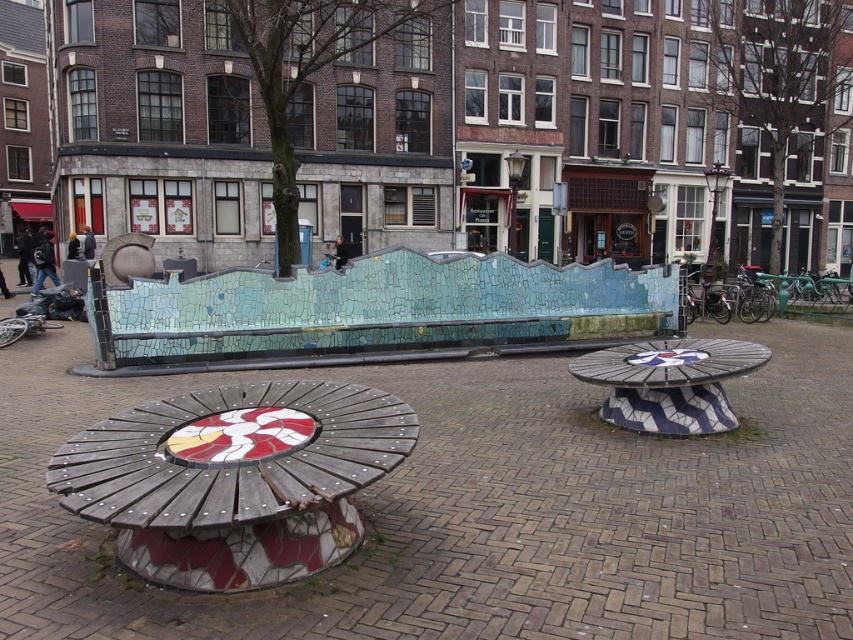
Question: Can you confirm if wooden mosaic bench at lower left is wider than white glossy mosaic table at center?

Choices:
 (A) no
 (B) yes

Answer: (B)

Question: Is wooden mosaic bench at lower left bigger than white glossy mosaic table at center?

Choices:
 (A) yes
 (B) no

Answer: (B)

Question: Which object is closer to the camera taking this photo?

Choices:
 (A) white glossy mosaic table at center
 (B) wooden mosaic bench at lower left

Answer: (B)

Question: Can you confirm if wooden mosaic bench at lower left is bigger than white glossy mosaic table at center?

Choices:
 (A) no
 (B) yes

Answer: (A)

Question: Which of the following is the farthest from the observer?

Choices:
 (A) white glossy mosaic table at center
 (B) wooden mosaic bench at lower left

Answer: (A)